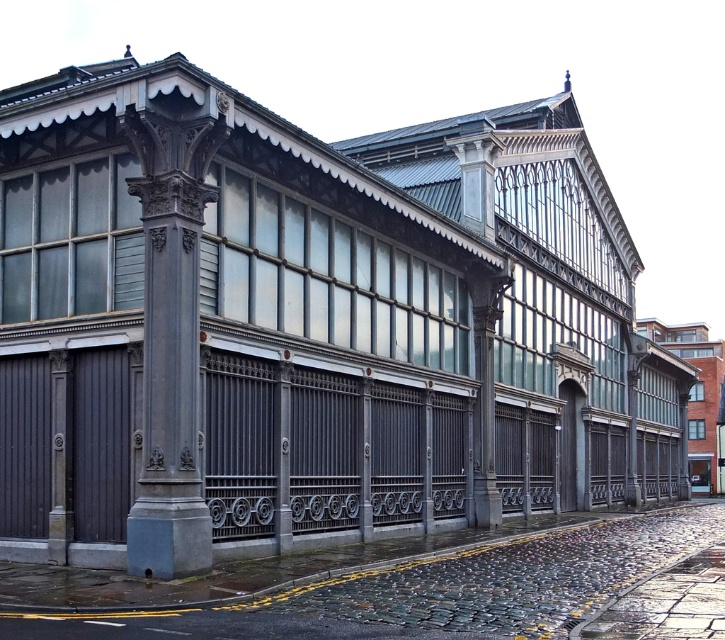
Question: Can you confirm if cobblestone pavement at lower center is positioned above slate gray stone column at left?

Choices:
 (A) yes
 (B) no

Answer: (B)

Question: Which object appears closest to the camera in this image?

Choices:
 (A) slate gray stone column at left
 (B) cobblestone pavement at lower center

Answer: (B)

Question: Does cobblestone pavement at lower center have a larger size compared to slate gray stone column at left?

Choices:
 (A) yes
 (B) no

Answer: (A)

Question: Does cobblestone pavement at lower center have a lesser width compared to slate gray stone column at left?

Choices:
 (A) no
 (B) yes

Answer: (A)

Question: Which point is farther to the camera?

Choices:
 (A) slate gray stone column at left
 (B) cobblestone pavement at lower center

Answer: (A)